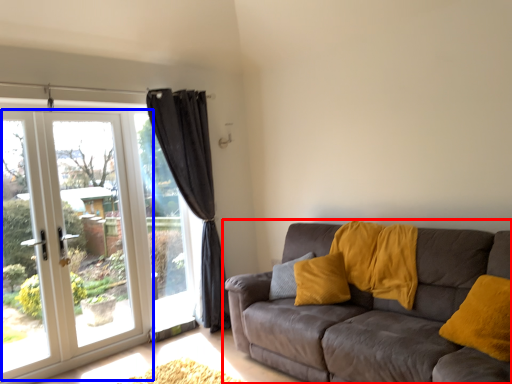
Question: Which point is closer to the camera, studio couch (highlighted by a red box) or door (highlighted by a blue box)?

Choices:
 (A) studio couch
 (B) door

Answer: (A)